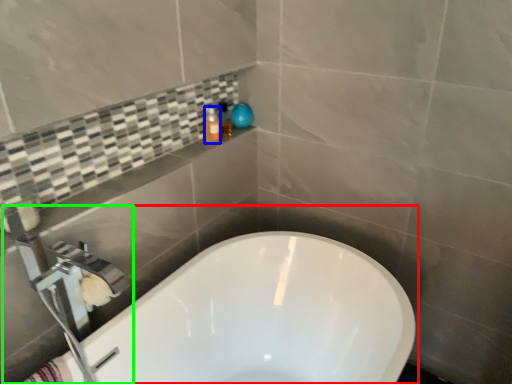
Question: Based on their relative distances, which object is nearer to bathtub (highlighted by a red box)? Choose from toiletry (highlighted by a blue box) and tap (highlighted by a green box).

Choices:
 (A) toiletry
 (B) tap

Answer: (B)